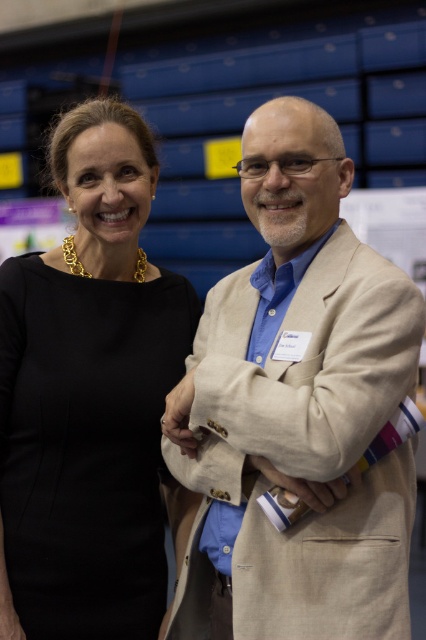
Can you confirm if beige textured blazer at center is positioned to the right of black satin dress at left?

Correct, you'll find beige textured blazer at center to the right of black satin dress at left.

Describe the element at coordinates (296, 410) in the screenshot. This screenshot has width=426, height=640. I see `beige textured blazer at center` at that location.

The width and height of the screenshot is (426, 640). Identify the location of beige textured blazer at center. (296, 410).